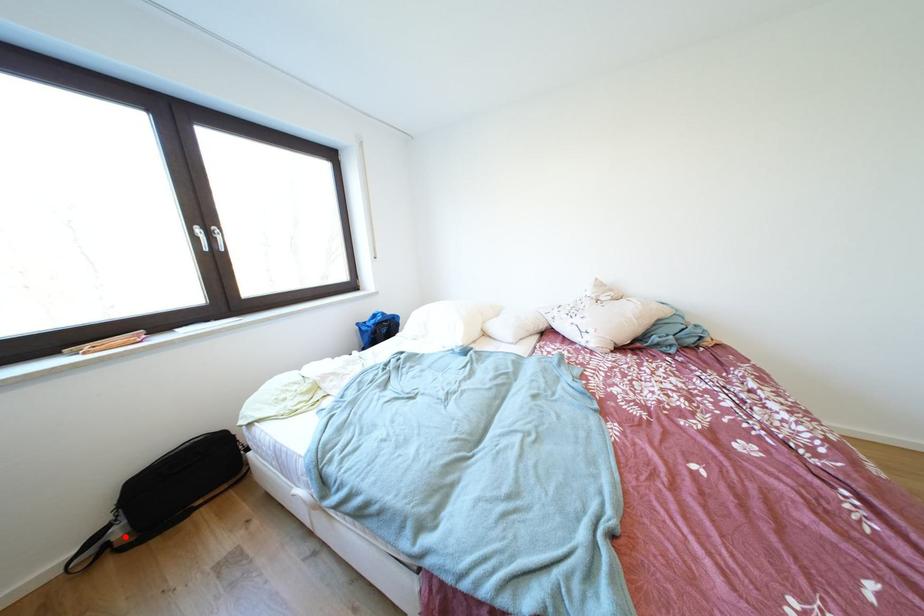
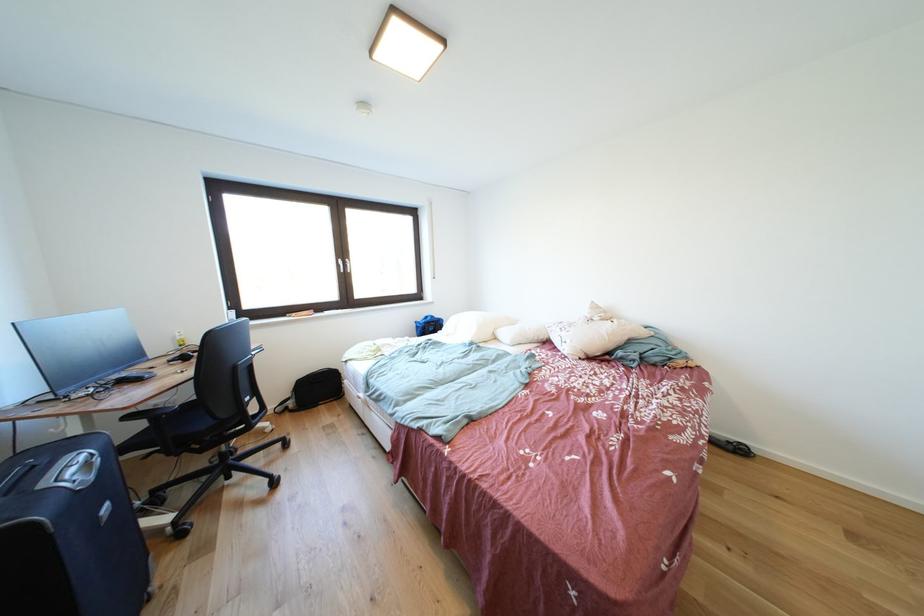
Question: I am providing you with two images of the same scene from different viewpoints. A red point is shown in image1. For the corresponding object point in image2, is it positioned nearer or farther from the camera?

Choices:
 (A) Nearer
 (B) Farther

Answer: (A)